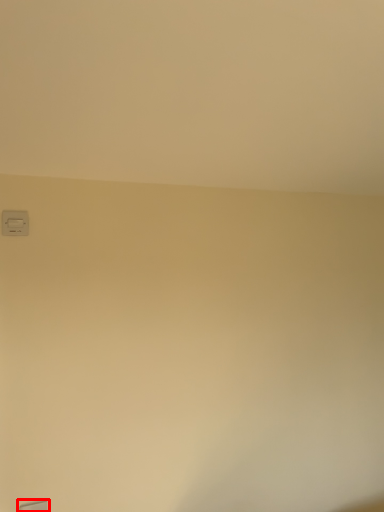
Question: From the image's perspective, what is the correct spatial relationship of window (annotated by the red box) in relation to light switch?

Choices:
 (A) above
 (B) below

Answer: (B)